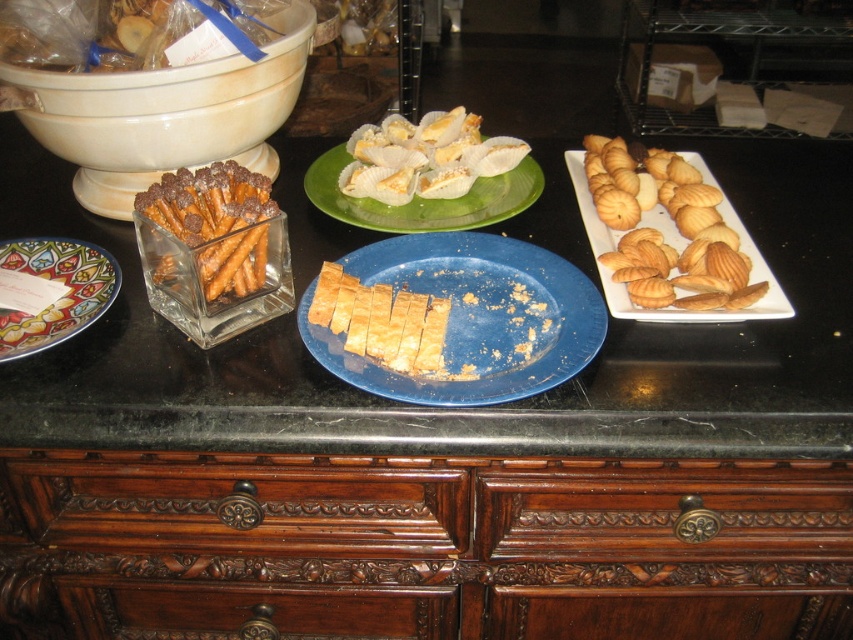
You are a caterer arranging desserts at a party. You have a new dessert that needs 6 inches of space between the blue matte plate at center and the green matte plate at center to fit. Can you place it there?

The distance between the blue matte plate at center and the green matte plate at center is 5.94 inches, which is slightly less than the required 6 inches. Therefore, the new dessert cannot be placed there due to insufficient space.

From the picture: You are at a buffet and want to grab a pastry. You see the golden crispy pastry at center and the green matte plate at center. Which one is closer to you?

The golden crispy pastry at center is closer to you because it is in front of the green matte plate at center.

You are at a buffet and want to choose between the golden crisp pastry at center and the golden crispy pastry at center. Which one is wider?

The golden crisp pastry at center is wider than the golden crispy pastry at center according to the description.